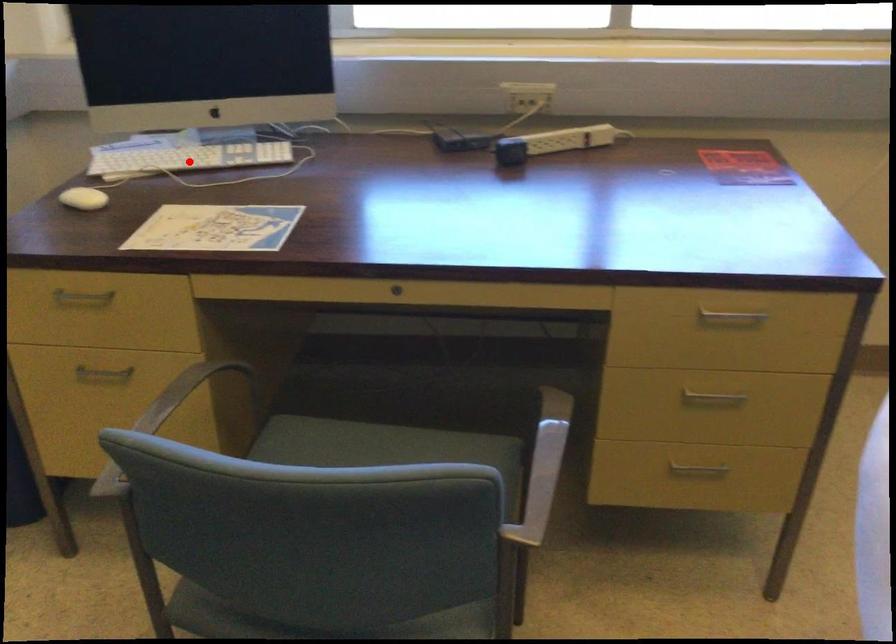
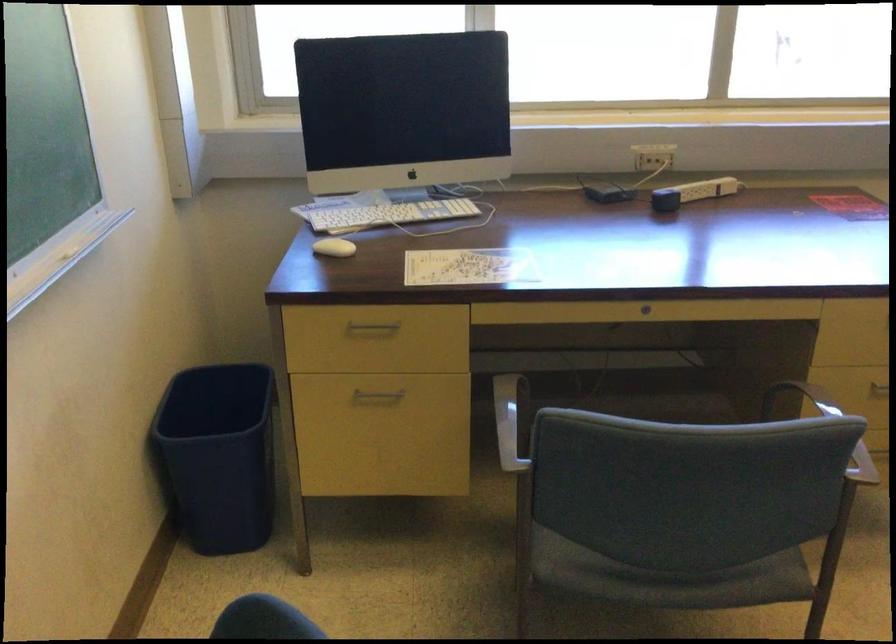
The point at the highlighted location is marked in the first image. Where is the corresponding point in the second image?

(389, 214)